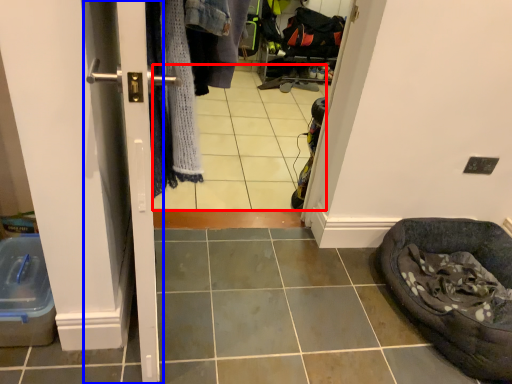
Question: Which object appears farthest to the camera in this image, tile (highlighted by a red box) or screen door (highlighted by a blue box)?

Choices:
 (A) tile
 (B) screen door

Answer: (A)